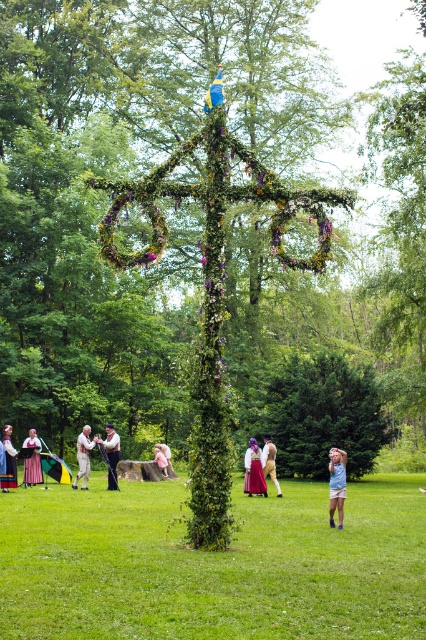
You are a photographer standing at the edge of the park. You want to capture a photo where both the blue denim shorts at lower right and the matte purple dress at center are visible. Which object should you focus on to ensure both are in frame?

To ensure both the blue denim shorts at lower right and the matte purple dress at center are visible, focus on the matte purple dress at center since it is larger and easier to spot, allowing you to adjust the camera angle to include the smaller blue denim shorts at lower right.

You are a photographer standing at the edge of the park. You want to take a photo that includes both the green grass at center and the green velvet dress at center. Which object should you focus on first to ensure both are in frame?

The green grass at center is bigger than the green velvet dress at center, so you should focus on the green grass at center first to ensure both are in frame.

You are a photographer standing at the edge of the park and want to capture both the blue denim shorts at lower right and the matte purple dress at center in the same frame. Based on their positions, which one is higher up in the image?

The blue denim shorts at lower right is located above the matte purple dress at center, so it is higher up in the image.